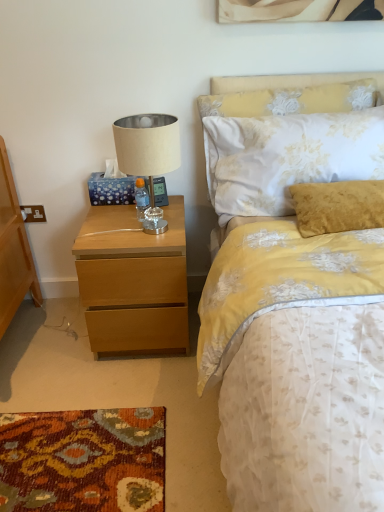
The image size is (384, 512). I want to click on free space in front of light wood nightstand at left, so click(119, 399).